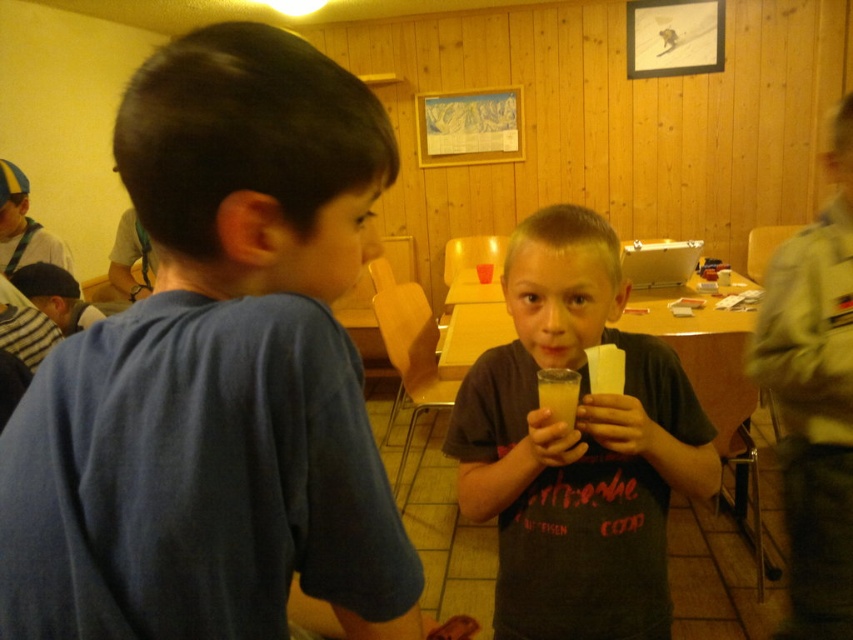
Based on the photo, is blue cotton shirt at upper left above matte gray shirt at center?

Correct, blue cotton shirt at upper left is located above matte gray shirt at center.

Does blue cotton shirt at upper left appear under matte gray shirt at center?

Actually, blue cotton shirt at upper left is above matte gray shirt at center.

Is point (242, 524) farther from camera compared to point (503, 396)?

No, (242, 524) is in front of (503, 396).

Image resolution: width=853 pixels, height=640 pixels. In order to click on blue cotton shirt at upper left in this screenshot , I will do `click(218, 372)`.